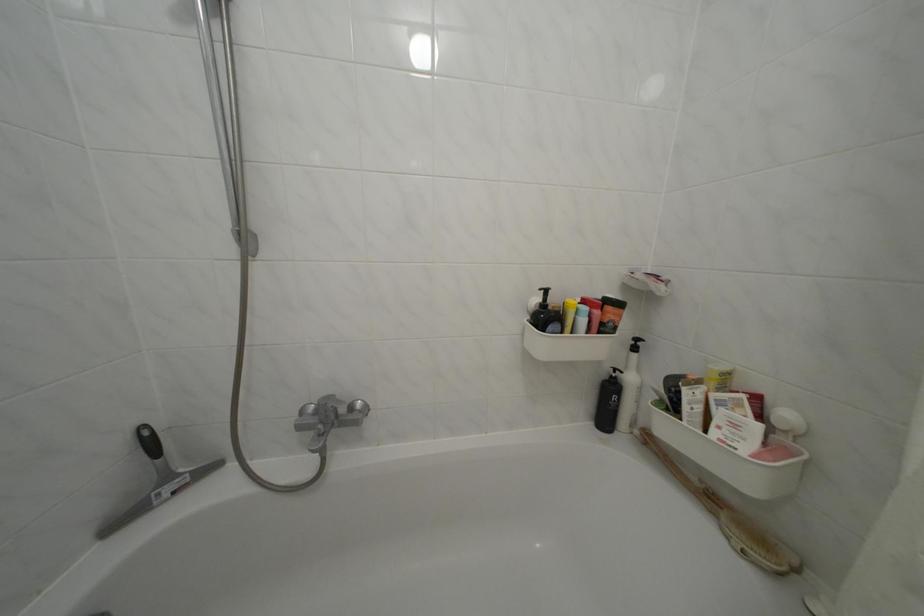
Image resolution: width=924 pixels, height=616 pixels. Describe the element at coordinates (332, 411) in the screenshot. I see `the faucet diverter knob` at that location.